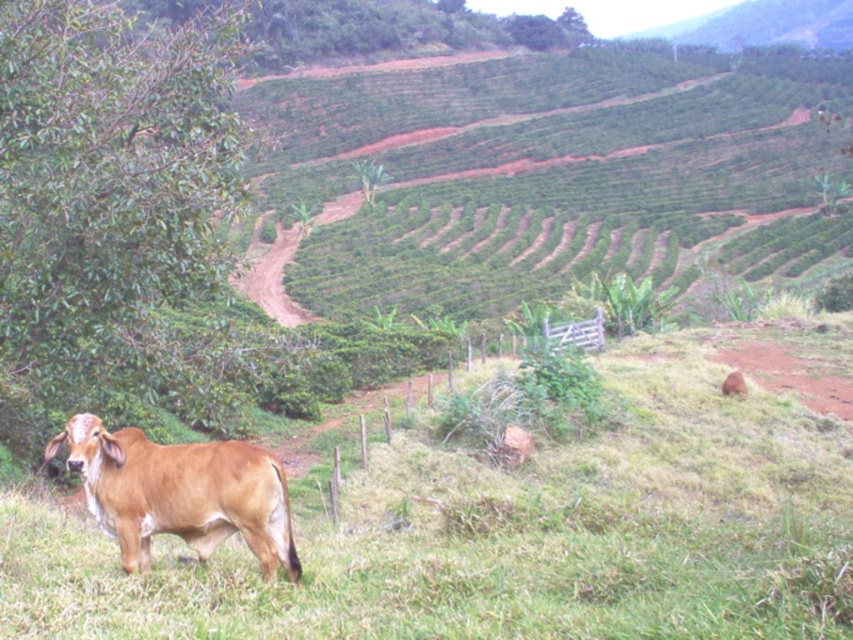
Looking at this image, measure the distance from green grassy at lower left to brown smooth cow at lower left.

green grassy at lower left is 20.04 feet from brown smooth cow at lower left.

Is the position of green grassy at lower left more distant than that of brown smooth cow at lower left?

No.

Where is `green grassy at lower left`? green grassy at lower left is located at coordinates (503, 536).

This screenshot has width=853, height=640. Identify the location of green grassy at lower left. point(503,536).